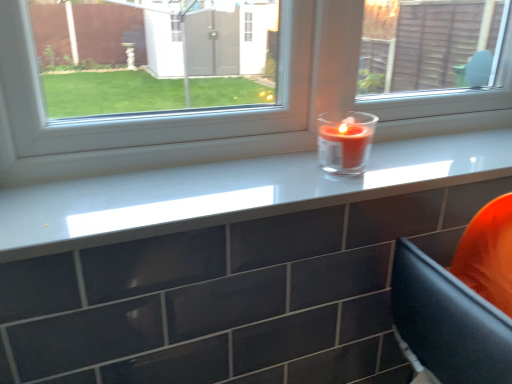
Locate an element on the screen. empty space that is ontop of matte glass candle at upper center (from a real-world perspective) is located at coordinates (308, 169).